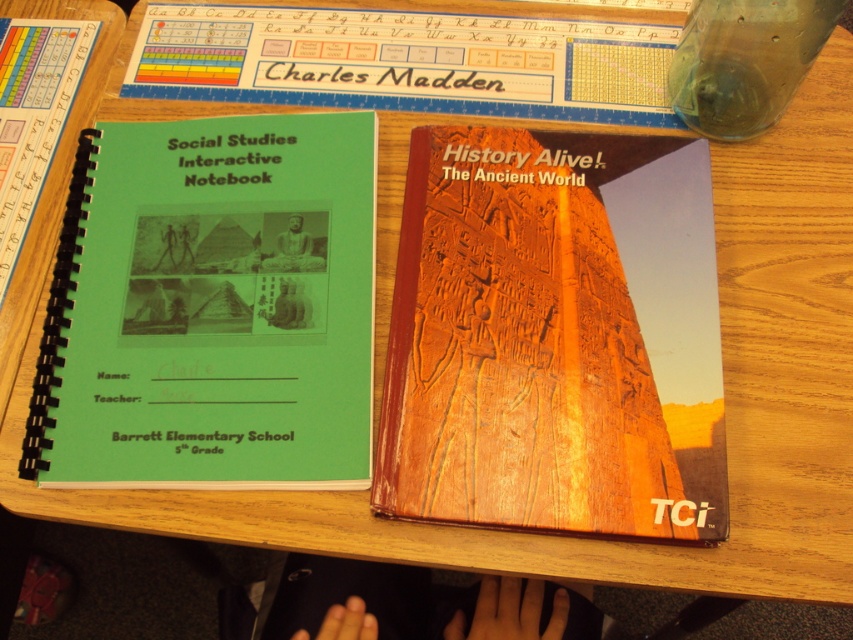
Question: Is wooden history alive! book at center thinner than green matte social studies interactive notebook at left?

Choices:
 (A) yes
 (B) no

Answer: (B)

Question: Among these objects, which one is farthest from the camera?

Choices:
 (A) green matte social studies interactive notebook at left
 (B) wooden history alive! book at center

Answer: (A)

Question: Which object is farther from the camera taking this photo?

Choices:
 (A) wooden history alive! book at center
 (B) green matte social studies interactive notebook at left
 (C) transparent glass bottle at upper right

Answer: (C)

Question: Can you confirm if wooden history alive! book at center is thinner than green matte social studies interactive notebook at left?

Choices:
 (A) no
 (B) yes

Answer: (A)

Question: Does wooden history alive! book at center appear under transparent glass bottle at upper right?

Choices:
 (A) no
 (B) yes

Answer: (B)

Question: Which of the following is the farthest from the observer?

Choices:
 (A) (717, 4)
 (B) (639, 477)

Answer: (A)